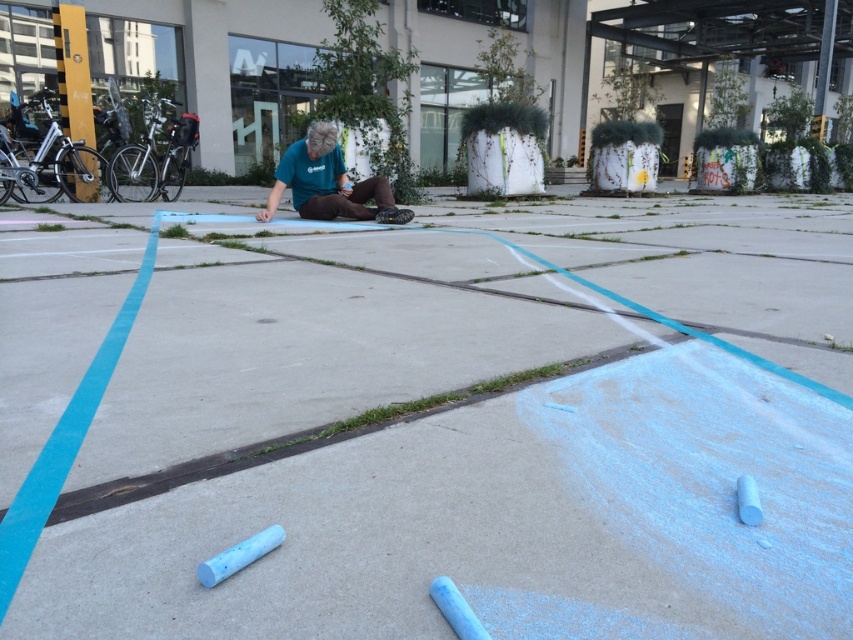
Question: Does smooth concrete pavement at center have a greater width compared to teal fabric shirt at center?

Choices:
 (A) yes
 (B) no

Answer: (A)

Question: Does smooth concrete pavement at center lie behind teal fabric shirt at center?

Choices:
 (A) no
 (B) yes

Answer: (A)

Question: Which point is closer to the camera?

Choices:
 (A) smooth concrete pavement at center
 (B) teal fabric shirt at center

Answer: (A)

Question: Which object appears closest to the camera in this image?

Choices:
 (A) teal fabric shirt at center
 (B) smooth concrete pavement at center

Answer: (B)

Question: Does smooth concrete pavement at center appear under teal fabric shirt at center?

Choices:
 (A) yes
 (B) no

Answer: (A)